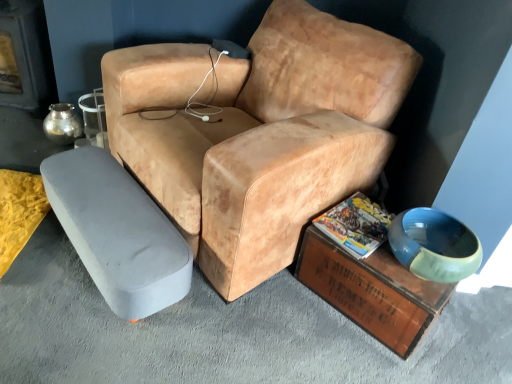
Locate an element on the screen. The width and height of the screenshot is (512, 384). vacant area to the right of gray fabric ottoman at lower left, acting as the first table starting from the left is located at coordinates (249, 326).